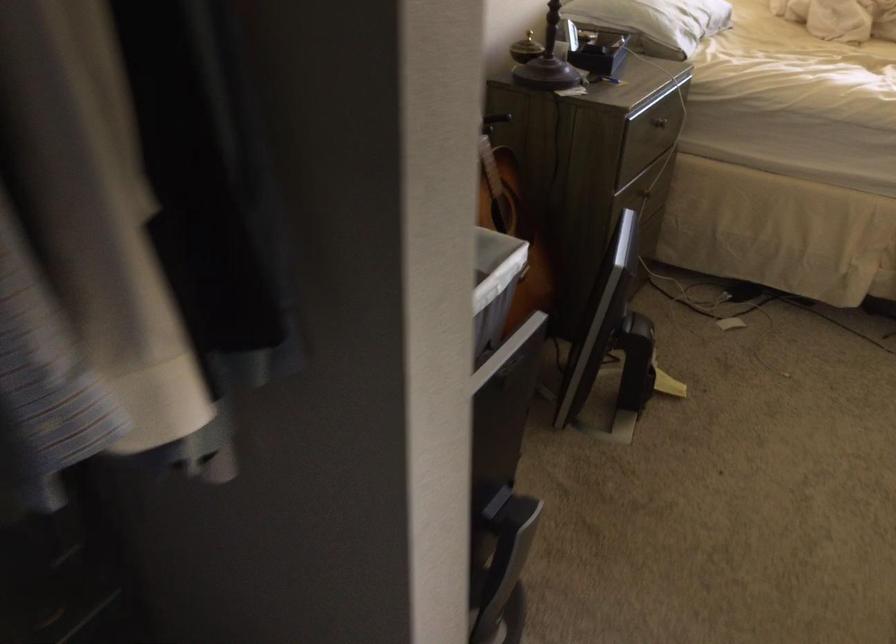
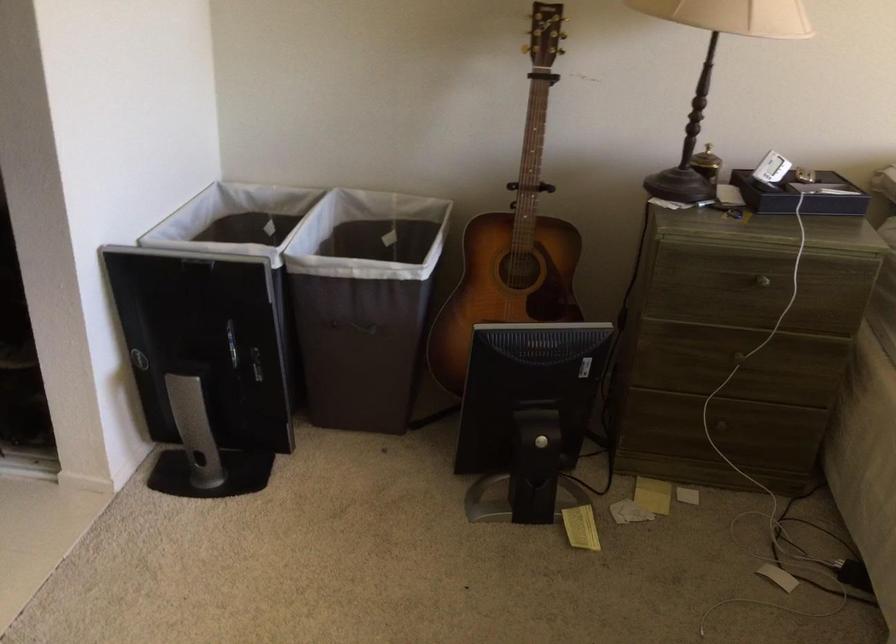
Locate, in the second image, the point that corresponds to point (664, 388) in the first image.

(581, 527)